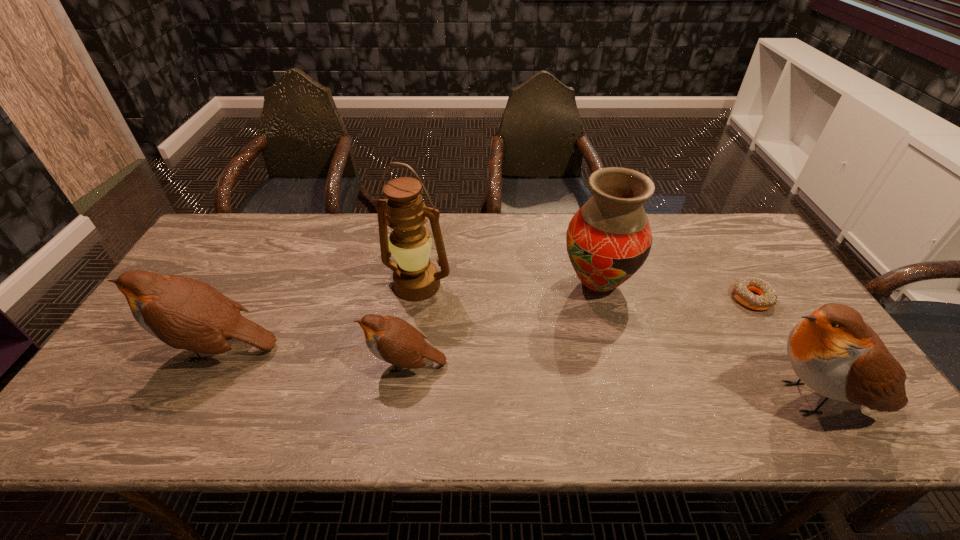
The width and height of the screenshot is (960, 540). What are the coordinates of `blank region between the third object from right to left and the rightmost bird` in the screenshot? It's located at (708, 341).

This screenshot has height=540, width=960. I want to click on empty space that is in between the second bird from left to right and the leftmost object, so click(312, 356).

Locate an element on the screen. vacant area that lies between the fourth tallest object and the doughnut is located at coordinates (484, 323).

Where is `vacant space that's between the leftmost object and the rightmost bird`? The width and height of the screenshot is (960, 540). vacant space that's between the leftmost object and the rightmost bird is located at coordinates (518, 373).

Image resolution: width=960 pixels, height=540 pixels. What are the coordinates of `vacant area between the third object from right to left and the second shortest object` in the screenshot? It's located at (501, 324).

Find the location of a particular element. The image size is (960, 540). blank region between the fifth tallest object and the second tallest bird is located at coordinates (312, 356).

This screenshot has height=540, width=960. Find the location of `free space that is in between the second bird from right to left and the rightmost bird`. free space that is in between the second bird from right to left and the rightmost bird is located at coordinates (612, 381).

The height and width of the screenshot is (540, 960). Find the location of `vacant space that's between the oil lamp and the third shortest object`. vacant space that's between the oil lamp and the third shortest object is located at coordinates (318, 316).

Select which object is the second closest to the shortest bird. Please provide its 2D coordinates. Your answer should be formatted as a tuple, i.e. [(x, y)], where the tuple contains the x and y coordinates of a point satisfying the conditions above.

[(184, 313)]

Locate which object ranks third in proximity to the leftmost object. Please provide its 2D coordinates. Your answer should be formatted as a tuple, i.e. [(x, y)], where the tuple contains the x and y coordinates of a point satisfying the conditions above.

[(608, 239)]